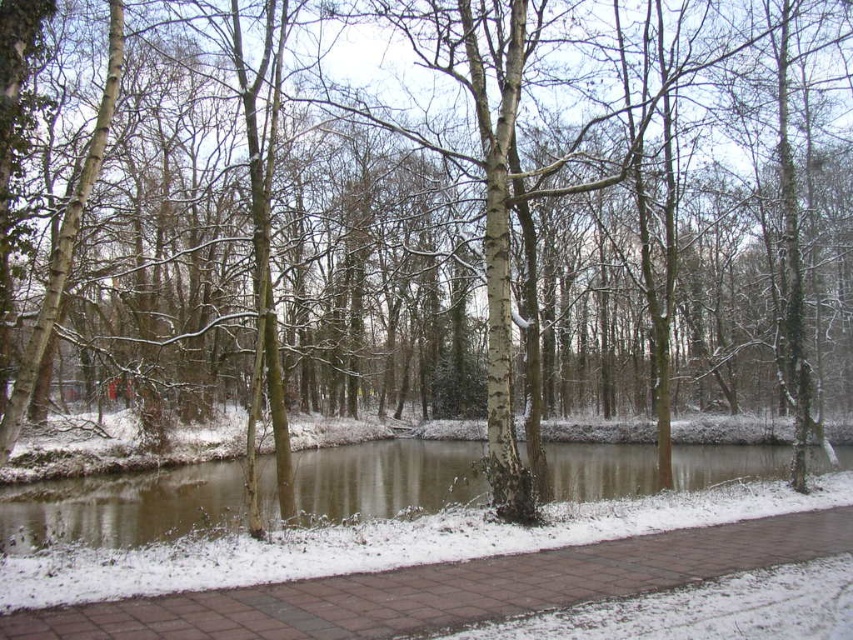
Does point (103, 634) come farther from viewer compared to point (376, 492)?

No, it is not.

Locate an element on the screen. The height and width of the screenshot is (640, 853). brick paved path at center is located at coordinates 448,588.

Who is more forward, (287, 621) or (22, 502)?

Point (287, 621)

Locate an element on the screen. The image size is (853, 640). brick paved path at center is located at coordinates (448, 588).